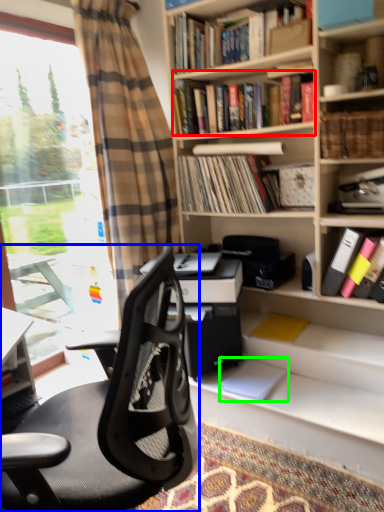
Question: Estimate the real-world distances between objects in this image. Which object is closer to book (highlighted by a red box), chair (highlighted by a blue box) or paperback book (highlighted by a green box)?

Choices:
 (A) chair
 (B) paperback book

Answer: (B)